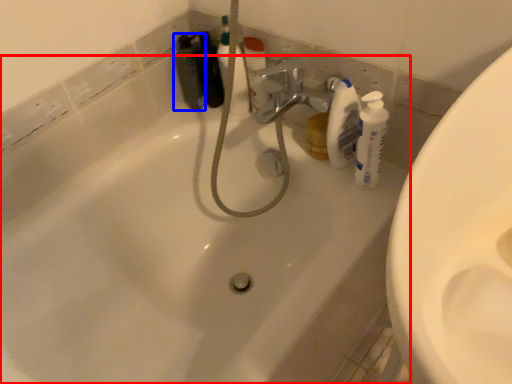
Question: Among these objects, which one is farthest to the camera, bathtub (highlighted by a red box) or toiletry (highlighted by a blue box)?

Choices:
 (A) bathtub
 (B) toiletry

Answer: (B)